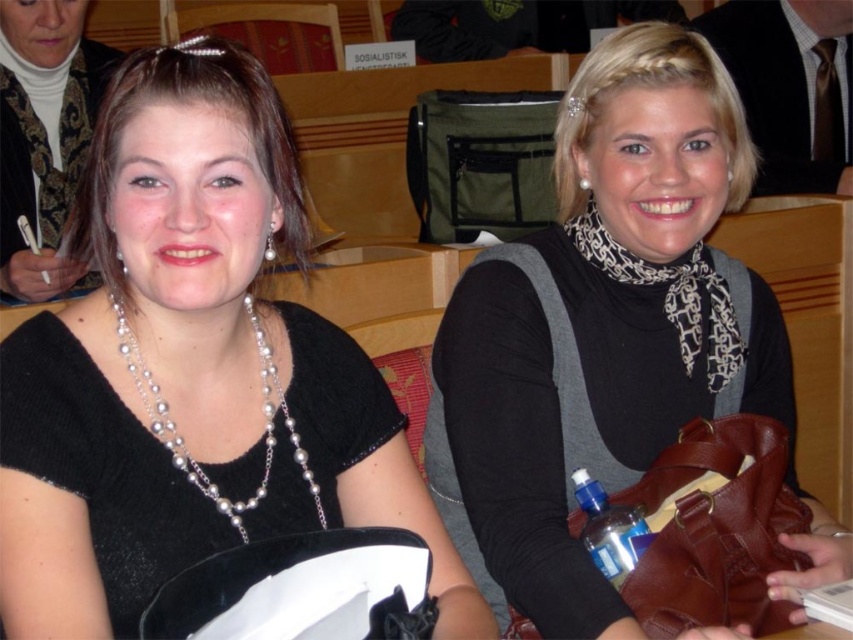
Question: Among these points, which one is nearest to the camera?

Choices:
 (A) (444, 317)
 (B) (13, 29)

Answer: (A)

Question: Is black velvet hat at left bigger than pearl necklace at center?

Choices:
 (A) no
 (B) yes

Answer: (B)

Question: Can you confirm if black velvet hat at left is wider than black matte scarf at upper right?

Choices:
 (A) yes
 (B) no

Answer: (B)

Question: Does black velvet hat at left come in front of pearl necklace at center?

Choices:
 (A) no
 (B) yes

Answer: (B)

Question: Which point appears closest to the camera in this image?

Choices:
 (A) (1, 481)
 (B) (611, 552)
 (C) (68, 112)

Answer: (A)

Question: Which point is closer to the camera?

Choices:
 (A) (61, 99)
 (B) (561, 572)
 (C) (589, 540)
 (D) (146, 376)

Answer: (D)